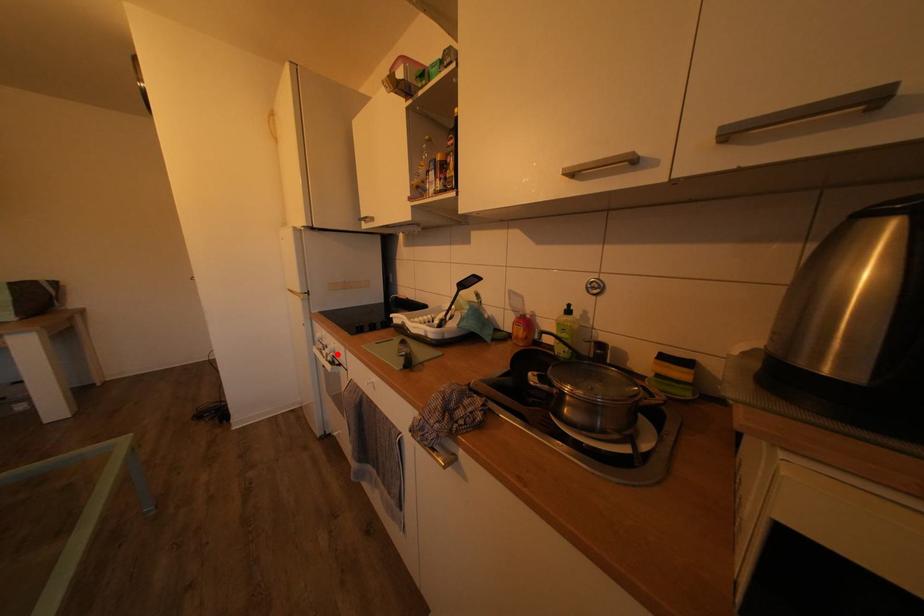
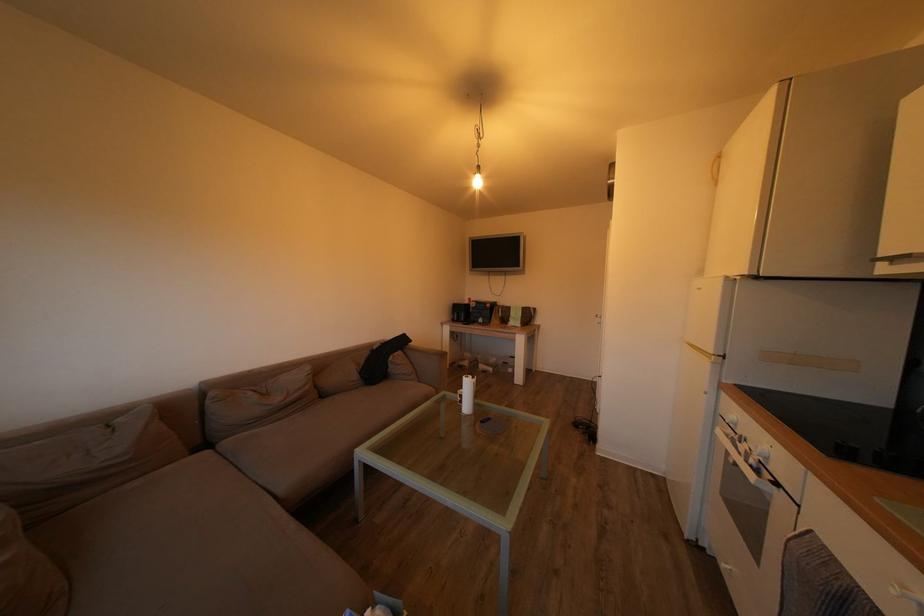
In the second image, find the point that corresponds to the highlighted location in the first image.

(759, 451)